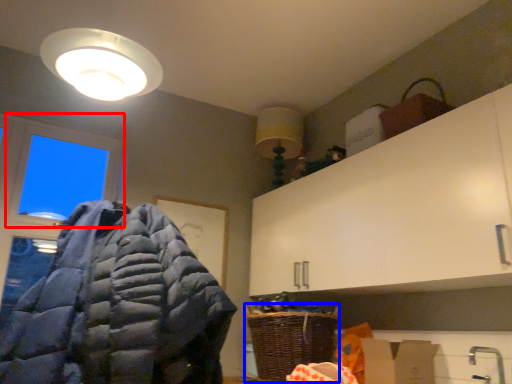
Question: Which object appears closest to the camera in this image, window (highlighted by a red box) or basket (highlighted by a blue box)?

Choices:
 (A) window
 (B) basket

Answer: (B)